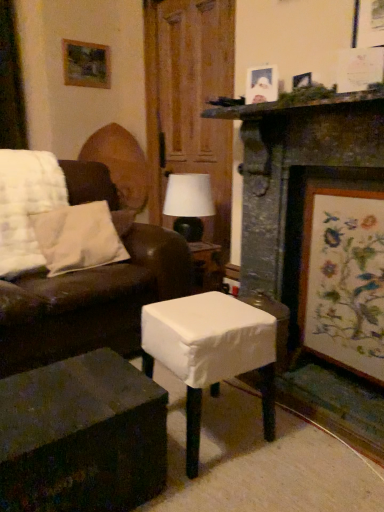
This screenshot has width=384, height=512. What do you see at coordinates (82, 437) in the screenshot?
I see `dark wood table at lower left, marked as the first table in a left-to-right arrangement` at bounding box center [82, 437].

Measure the distance between point [346,313] and camera.

A distance of 6.01 feet exists between point [346,313] and camera.

Identify the location of wooden framed artwork at right, acting as the third picture frame starting from the top. (343, 275).

Where is `wooden picture frame at upper left, which is the third picture frame from bottom to top`? The height and width of the screenshot is (512, 384). wooden picture frame at upper left, which is the third picture frame from bottom to top is located at coordinates (86, 64).

Describe the element at coordinates (91, 303) in the screenshot. The width and height of the screenshot is (384, 512). I see `leather couch at left` at that location.

The height and width of the screenshot is (512, 384). What do you see at coordinates (194, 99) in the screenshot?
I see `wooden door at center` at bounding box center [194, 99].

The height and width of the screenshot is (512, 384). What do you see at coordinates (294, 170) in the screenshot? I see `stone fireplace at center` at bounding box center [294, 170].

Identify the location of dark wood table at lower left, marked as the first table in a left-to-right arrangement. This screenshot has height=512, width=384. (82, 437).

Is wooden door at center positioned far away from white fabric-covered stool at center, which ranks as the first table in right-to-left order?

That's right, there is a large distance between wooden door at center and white fabric-covered stool at center, which ranks as the first table in right-to-left order.

Considering the sizes of objects wooden door at center and white fabric-covered stool at center, positioned as the second table in left-to-right order, in the image provided, who is smaller, wooden door at center or white fabric-covered stool at center, positioned as the second table in left-to-right order,?

white fabric-covered stool at center, positioned as the second table in left-to-right order, is smaller.

Can you confirm if wooden door at center is positioned to the right of white fabric-covered stool at center, positioned as the second table in left-to-right order?

Incorrect, wooden door at center is not on the right side of white fabric-covered stool at center, positioned as the second table in left-to-right order.

Is wooden door at center facing away from white fabric-covered stool at center, which ranks as the first table in right-to-left order?

No.

Is white matte table lamp at center with white fabric-covered stool at center, positioned as the second table in left-to-right order?

white matte table lamp at center is not next to white fabric-covered stool at center, positioned as the second table in left-to-right order, and they're not touching.

From the image's perspective, is white matte table lamp at center located above white fabric-covered stool at center, which ranks as the first table in right-to-left order?

Yes, from the image's perspective, white matte table lamp at center is above white fabric-covered stool at center, which ranks as the first table in right-to-left order.

Can you tell me how much white matte table lamp at center and white fabric-covered stool at center, positioned as the second table in left-to-right order, differ in facing direction?

white matte table lamp at center and white fabric-covered stool at center, positioned as the second table in left-to-right order, are facing 83.8 degrees away from each other.

Where is `the 1st table located beneath the white matte table lamp at center (from a real-world perspective)`? Image resolution: width=384 pixels, height=512 pixels. the 1st table located beneath the white matte table lamp at center (from a real-world perspective) is located at coordinates coord(211,352).

Identify the location of pillow in front of the white matte table lamp at center. The image size is (384, 512). (78, 238).

Is white matte table lamp at center positioned far away from white cotton pillow at left?

No.

Between white matte table lamp at center and white cotton pillow at left, which one has larger width?

With larger width is white cotton pillow at left.

Can you confirm if white matte table lamp at center is shorter than white cotton pillow at left?

No.

Does dark wood table at lower left, marked as the first table in a left-to-right arrangement, have a larger size compared to stone fireplace at center?

No, dark wood table at lower left, marked as the first table in a left-to-right arrangement, is not bigger than stone fireplace at center.

From the image's perspective, is dark wood table at lower left, marked as the first table in a left-to-right arrangement, under stone fireplace at center?

Yes.

Based on the photo, which object is closer to the camera, matte white picture frame at upper right, acting as the 2th picture frame starting from the top, or stone fireplace at center?

stone fireplace at center is closer to the camera.

Considering the relative sizes of matte white picture frame at upper right, the 2th picture frame when ordered from front to back, and stone fireplace at center in the image provided, is matte white picture frame at upper right, the 2th picture frame when ordered from front to back, shorter than stone fireplace at center?

Indeed, matte white picture frame at upper right, the 2th picture frame when ordered from front to back, has a lesser height compared to stone fireplace at center.

Is matte white picture frame at upper right, which is counted as the second picture frame, starting from the right, bigger than stone fireplace at center?

No, matte white picture frame at upper right, which is counted as the second picture frame, starting from the right, is not bigger than stone fireplace at center.

Consider the image. From the image's perspective, is matte white picture frame at upper right, which is counted as the 2th picture frame, starting from the bottom, located above stone fireplace at center?

Indeed, from the image's perspective, matte white picture frame at upper right, which is counted as the 2th picture frame, starting from the bottom, is shown above stone fireplace at center.

Does dark wood table at lower left, marked as the first table in a left-to-right arrangement, have a greater height compared to leather couch at left?

No, dark wood table at lower left, marked as the first table in a left-to-right arrangement, is not taller than leather couch at left.

Based on the photo, can you confirm if dark wood table at lower left, positioned as the 2th table in right-to-left order, is bigger than leather couch at left?

Actually, dark wood table at lower left, positioned as the 2th table in right-to-left order, might be smaller than leather couch at left.

Identify the location of the 2nd table located beneath the stone fireplace at center (from a real-world perspective). (82, 437).

Would you consider stone fireplace at center to be distant from dark wood table at lower left, positioned as the 2th table in right-to-left order?

Absolutely, stone fireplace at center is distant from dark wood table at lower left, positioned as the 2th table in right-to-left order.

How different are the orientations of stone fireplace at center and dark wood table at lower left, marked as the first table in a left-to-right arrangement, in degrees?

stone fireplace at center and dark wood table at lower left, marked as the first table in a left-to-right arrangement, are facing 91 degrees away from each other.

Is stone fireplace at center outside of dark wood table at lower left, positioned as the 2th table in right-to-left order?

Yes.

From the image's perspective, count 1st tables downward from the wooden door at center and point to it. Please provide its 2D coordinates.

[(211, 352)]

In order to click on the 1st table in front of the white matte table lamp at center in this screenshot , I will do `click(211, 352)`.

Which object lies further to the anchor point wooden framed artwork at right, the third picture frame when ordered from left to right, white cotton pillow at left or leather couch at left?

The object further to wooden framed artwork at right, the third picture frame when ordered from left to right, is white cotton pillow at left.

Consider the image. From the image, which object appears to be nearer to wooden picture frame at upper left, arranged as the 3th picture frame when viewed from the right, wooden framed artwork at right, which is the first picture frame in bottom-to-top order, or wooden door at center?

wooden door at center is positioned closer to the anchor wooden picture frame at upper left, arranged as the 3th picture frame when viewed from the right.

Estimate the real-world distances between objects in this image. Which object is further from white matte table lamp at center, wooden door at center or white cotton pillow at left?

wooden door at center is further to white matte table lamp at center.

When comparing their distances from white cotton pillow at left, does wooden picture frame at upper left, which is the third picture frame from bottom to top, or leather couch at left seem further?

The object further to white cotton pillow at left is wooden picture frame at upper left, which is the third picture frame from bottom to top.

When comparing their distances from white fabric-covered stool at center, which ranks as the first table in right-to-left order, does white cotton pillow at left or dark wood table at lower left, marked as the first table in a left-to-right arrangement, seem closer?

The object closer to white fabric-covered stool at center, which ranks as the first table in right-to-left order, is dark wood table at lower left, marked as the first table in a left-to-right arrangement.

When comparing their distances from wooden framed artwork at right, the third picture frame when ordered from left to right, does leather couch at left or white matte table lamp at center seem closer?

leather couch at left.

From the image, which object appears to be nearer to wooden door at center, white cotton pillow at left or matte white picture frame at upper right, which is counted as the 2th picture frame, starting from the bottom?

Among the two, matte white picture frame at upper right, which is counted as the 2th picture frame, starting from the bottom, is located nearer to wooden door at center.

Looking at this image, which object lies nearer to the anchor point leather couch at left, dark wood table at lower left, marked as the first table in a left-to-right arrangement, or wooden framed artwork at right, which ranks as the 3th picture frame in back-to-front order?

dark wood table at lower left, marked as the first table in a left-to-right arrangement, is positioned closer to the anchor leather couch at left.

At what (x,y) coordinates should I click in order to perform the action: click on studio couch that lies between matte white picture frame at upper right, acting as the 2th picture frame starting from the top, and dark wood table at lower left, positioned as the 2th table in right-to-left order, from top to bottom. Please return your answer as a coordinate pair (x, y). This screenshot has height=512, width=384. Looking at the image, I should click on 91,303.

The height and width of the screenshot is (512, 384). Identify the location of fireplace situated between white fabric-covered stool at center, which ranks as the first table in right-to-left order, and wooden framed artwork at right, which ranks as the first picture frame in right-to-left order, from left to right. (294, 170).

In order to click on table between dark wood table at lower left, marked as the first table in a left-to-right arrangement, and stone fireplace at center from left to right in this screenshot , I will do `click(211, 352)`.

This screenshot has height=512, width=384. In order to click on picture frame between leather couch at left and wooden framed artwork at right, acting as the third picture frame starting from the top, from left to right in this screenshot , I will do `click(261, 85)`.